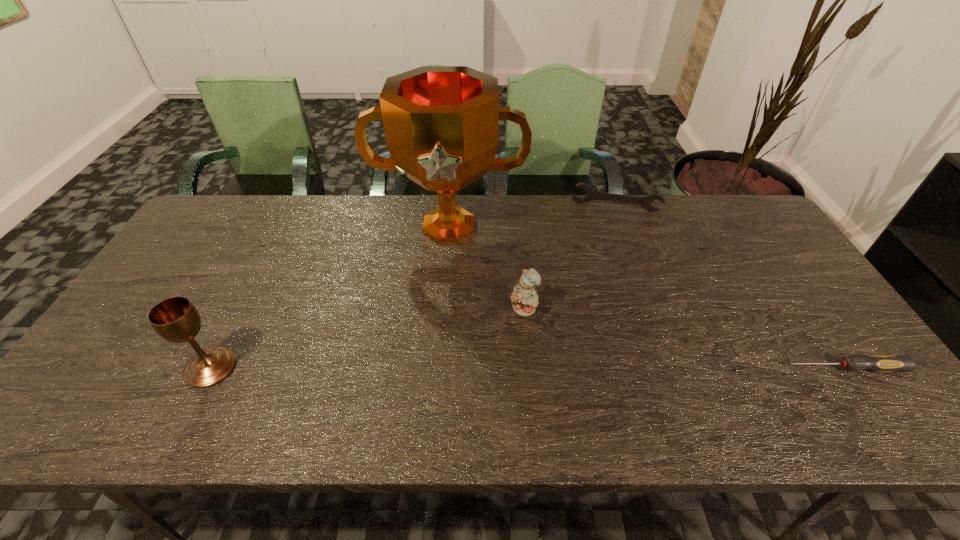
The image size is (960, 540). In order to click on free space in the image that satisfies the following two spatial constraints: 1. on the front side of the rightmost object; 2. insert the tallest object into a screw head in this screenshot , I will do `click(438, 368)`.

You are a GUI agent. You are given a task and a screenshot of the screen. Output one action in this format:
    pyautogui.click(x=<x>, y=<y>)
    Task: Click on the vacant point that satisfies the following two spatial constraints: 1. on the back side of the third farthest object; 2. on the right side of the second tallest object
    This screenshot has height=540, width=960.
    Given the screenshot: What is the action you would take?
    pyautogui.click(x=240, y=310)